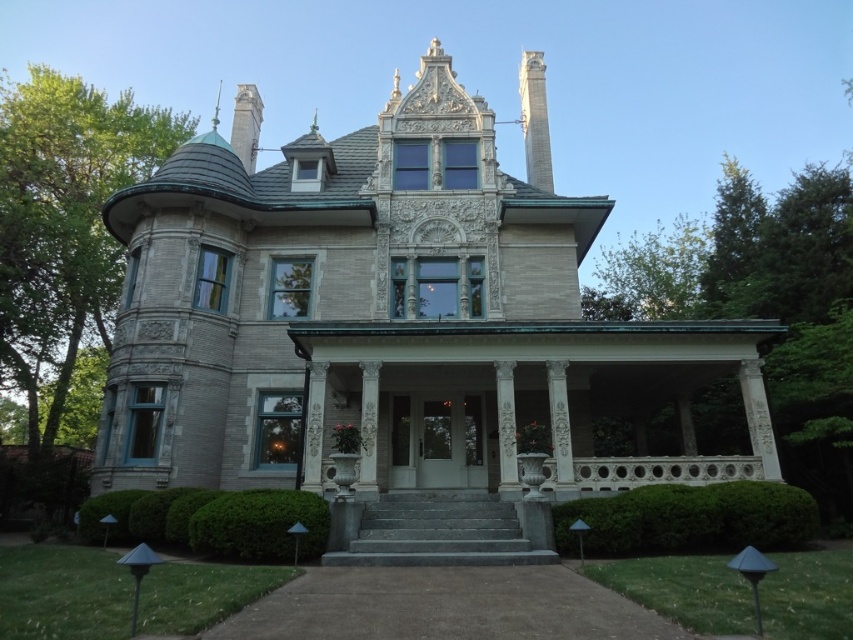
You are standing at the base of the grand Victorian house and want to determine which of the two points, point [637,499] or point [450,538], is closer to you. Based on the house layout, which point is nearer?

Point [637,499] is closer to the viewer than point [450,538].

You are a visitor approaching the stone mansion at center and see the gray stone steps at center. Which object is closer to you as you approach the house?

The gray stone steps at center are closer to you than the stone mansion at center because the steps are in front of the mansion.